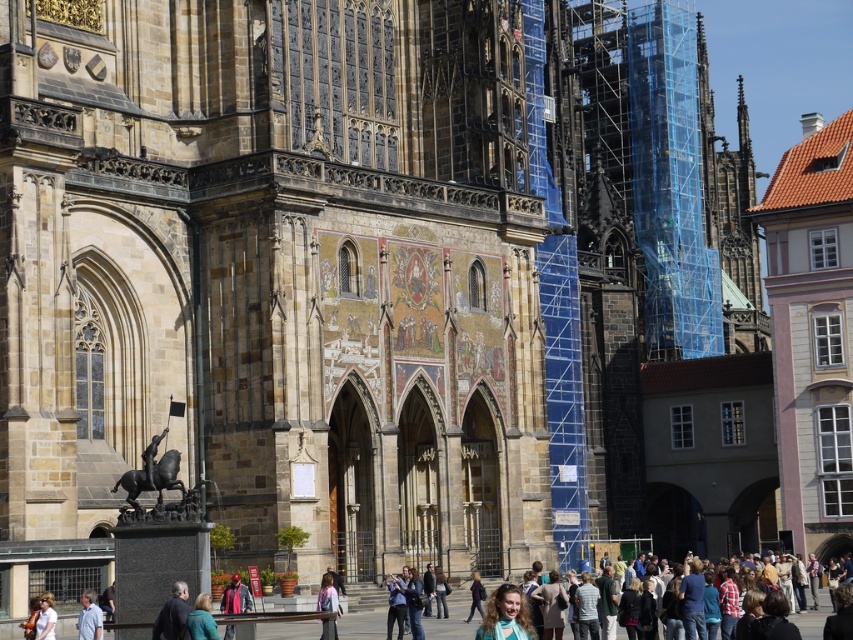
You are a photographer planning to take a group photo of the dark blue jacket at lower center and the light blue shirt at lower left in front of the cathedral. Considering their sizes, which one should you position closer to the camera to ensure both appear proportionally sized in the photo?

The dark blue jacket at lower center is larger in size than the light blue shirt at lower left. To make them appear proportionally sized in the photo, position the light blue shirt at lower left closer to the camera since it is smaller, while keeping the larger dark blue jacket at lower center farther back.

You are a tourist standing in front of the cathedral and want to take a photo of the stained glass window. There are two people in your way, a dark blue jacket at lower center and a light blue shirt at lower left. Which direction should you move to avoid them?

The dark blue jacket at lower center is to the right of light blue shirt at lower left. To avoid both, move to the left of the light blue shirt at lower left or to the right of the dark blue jacket at lower center.

You are a tour guide leading a group to the cathedral entrance. You see a tourist wearing a dark blue jacket at lower center and another tourist wearing a light blue shirt at lower left. If you want to ensure that both tourists can hear your explanation clearly, what is the maximum distance you should maintain between you and the farthest tourist?

The distance between the dark blue jacket at lower center and the light blue shirt at lower left is 4.07 meters. To ensure both tourists can hear clearly, the tour guide should stay within 2.035 meters from the farthest tourist, which is half of the total distance between them.